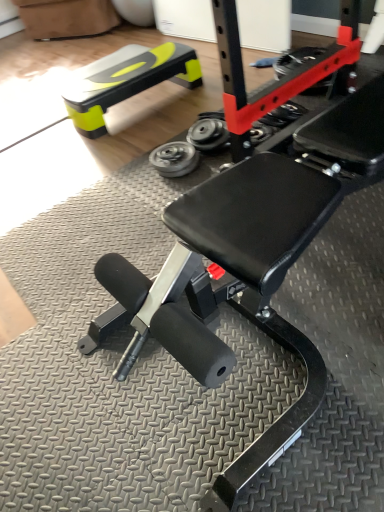
Identify the location of free space in front of metallic gray wheel at center, the 2th wheel viewed from the left. [215, 161].